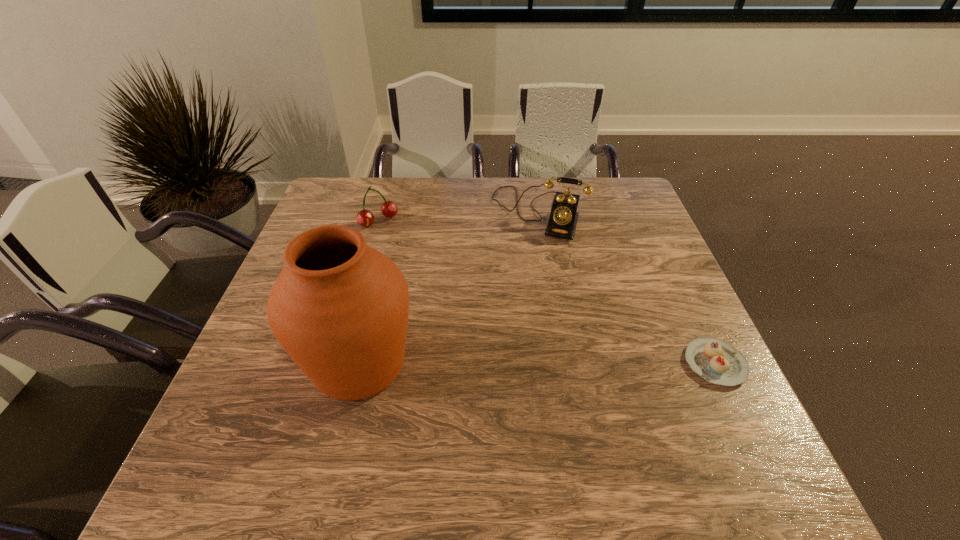
Locate an element on the screen. object situated at the near left corner is located at coordinates (339, 308).

The width and height of the screenshot is (960, 540). In the image, there is a desktop. What are the coordinates of `vacant area at the far edge` in the screenshot? It's located at (463, 209).

What are the coordinates of `vacant space at the near edge of the desktop` in the screenshot? It's located at (417, 417).

Where is `blank area at the left edge`? The width and height of the screenshot is (960, 540). blank area at the left edge is located at coordinates (254, 366).

Identify the location of vacant space at the right edge of the desktop. (684, 296).

The height and width of the screenshot is (540, 960). What are the coordinates of `empty space that is in between the tallest object and the shortest object` in the screenshot? It's located at (538, 363).

At what (x,y) coordinates should I click in order to perform the action: click on empty location between the cherry and the cupcake. Please return your answer as a coordinate pair (x, y). The image size is (960, 540). Looking at the image, I should click on (547, 292).

Find the location of a particular element. This screenshot has width=960, height=540. unoccupied position between the urn and the telephone is located at coordinates (449, 288).

At what (x,y) coordinates should I click in order to perform the action: click on free spot between the second object from right to left and the cherry. Please return your answer as a coordinate pair (x, y). The width and height of the screenshot is (960, 540). Looking at the image, I should click on pos(459,217).

Where is `free spot between the shortest object and the urn`? free spot between the shortest object and the urn is located at coordinates (538, 363).